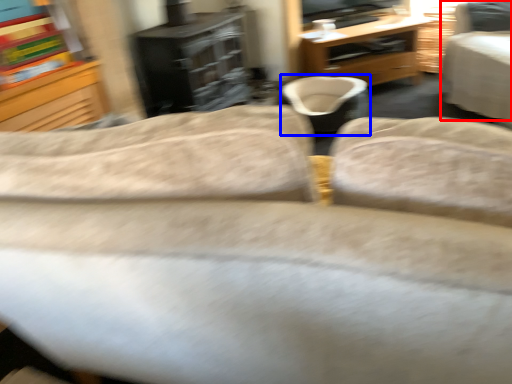
Question: Which object appears farthest to the camera in this image, chair (highlighted by a red box) or bean bag chair (highlighted by a blue box)?

Choices:
 (A) chair
 (B) bean bag chair

Answer: (B)